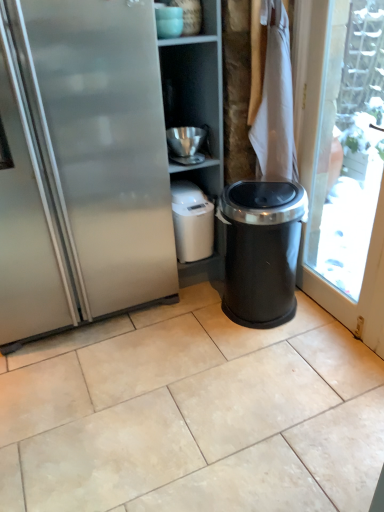
Image resolution: width=384 pixels, height=512 pixels. What are the coordinates of `blank space to the left of black plastic trash can at right` in the screenshot? It's located at (196, 330).